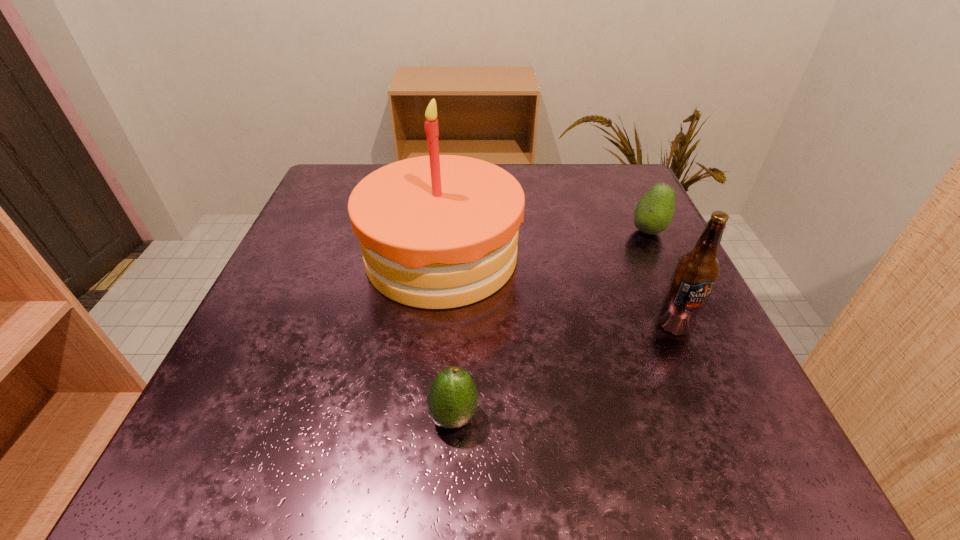
The width and height of the screenshot is (960, 540). I want to click on empty space between the second tallest object and the right avocado, so click(661, 278).

This screenshot has height=540, width=960. In order to click on free spot between the nearer avocado and the birthday cake in this screenshot , I will do `click(447, 336)`.

Identify the location of vacant area that lies between the nearest object and the right avocado. (551, 323).

Find the location of `vacant point located between the beer bottle and the right avocado`. vacant point located between the beer bottle and the right avocado is located at coordinates (661, 278).

This screenshot has width=960, height=540. Find the location of `free spot between the shorter avocado and the right avocado`. free spot between the shorter avocado and the right avocado is located at coordinates (551, 323).

Identify the location of empty location between the beer bottle and the farther avocado. (661, 278).

The width and height of the screenshot is (960, 540). Identify the location of free space between the right avocado and the tallest object. (545, 244).

You are a GUI agent. You are given a task and a screenshot of the screen. Output one action in this format:
    pyautogui.click(x=<x>, y=<y>)
    Task: Click on the empty location between the birthday cake and the shortest object
    The image size is (960, 540).
    Given the screenshot: What is the action you would take?
    coord(447,336)

Identify the location of unoccupied area between the birthday cake and the beer bottle. (558, 291).

You are a GUI agent. You are given a task and a screenshot of the screen. Output one action in this format:
    pyautogui.click(x=<x>, y=<y>)
    Task: Click on the vacant area between the birthday cake and the nearest object
    This screenshot has height=540, width=960.
    Given the screenshot: What is the action you would take?
    pyautogui.click(x=447, y=336)